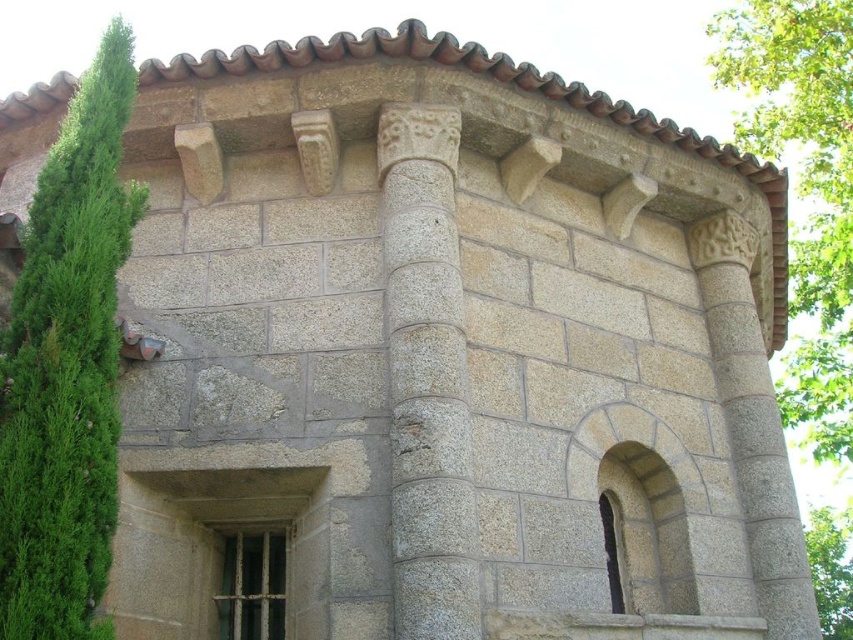
You are standing in front of the stone structure and notice two green leafy trees. Which tree, the green leafy tree at left or the green leafy tree at upper right, is positioned higher relative to the other?

The green leafy tree at left is located above the green leafy tree at upper right.

You are standing at the entrance of the historical stone structure and notice the gray stone column at center and the green leafy tree at upper right. Based on their positions, which object is closer to you?

The gray stone column at center is closer to you since it is only 60.61 feet away from the green leafy tree at upper right, meaning the tree is farther away.